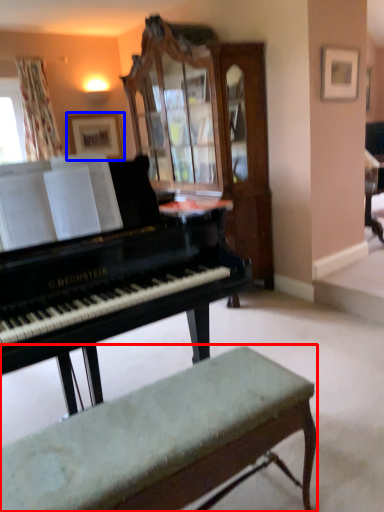
Question: Which object is further to the camera taking this photo, bench (highlighted by a red box) or picture frame (highlighted by a blue box)?

Choices:
 (A) bench
 (B) picture frame

Answer: (B)